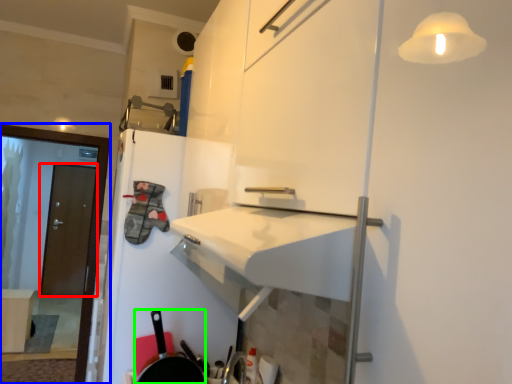
Question: Based on their relative distances, which object is farther from door (highlighted by a red box)? Choose from screen door (highlighted by a blue box) and frying pan (highlighted by a green box).

Choices:
 (A) screen door
 (B) frying pan

Answer: (B)